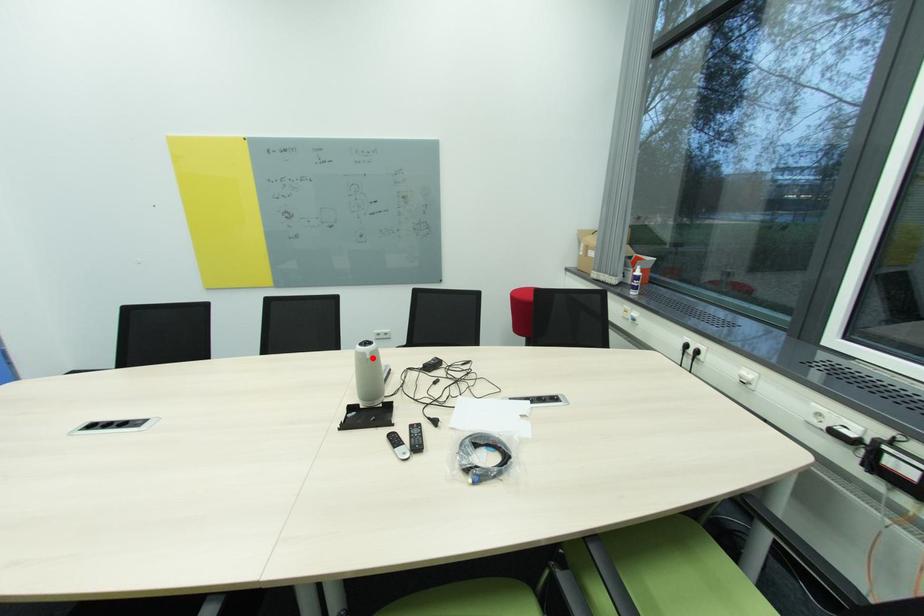
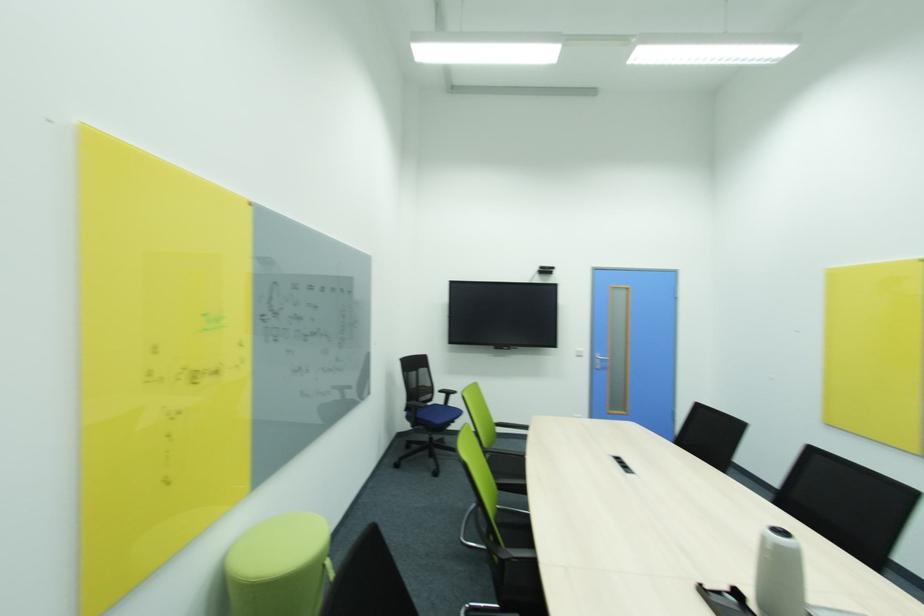
In the second image, find the point that corresponds to the highlighted location in the first image.

(774, 548)